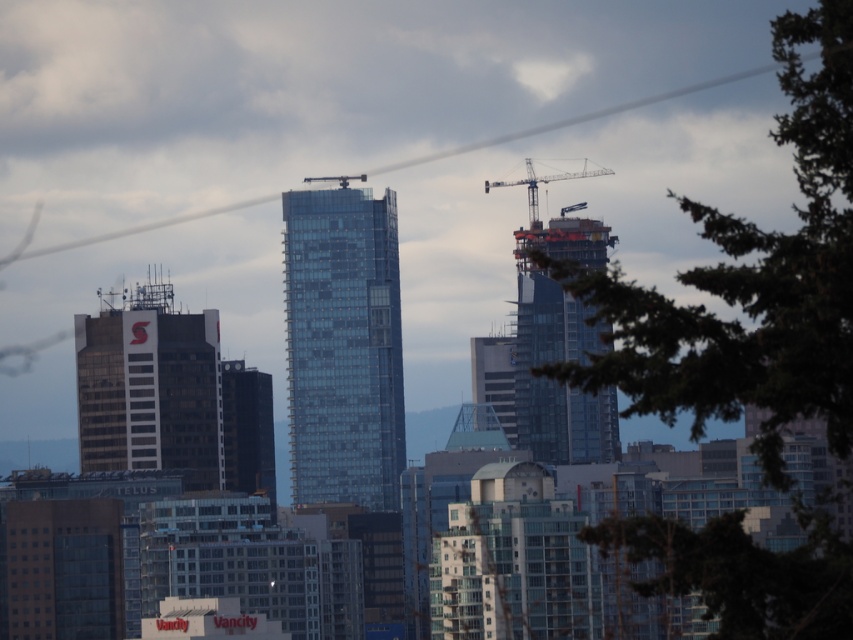
Question: Is green leafy tree at upper right above transparent glass building at center?

Choices:
 (A) yes
 (B) no

Answer: (A)

Question: Does green leafy tree at upper right come behind metallic gray crane at upper right?

Choices:
 (A) yes
 (B) no

Answer: (A)

Question: Considering the real-world distances, which object is closest to the transparent glass building at center?

Choices:
 (A) glassy steel skyscraper at center
 (B) green leafy tree at center
 (C) metallic gray crane at upper right

Answer: (A)

Question: Which object appears farthest from the camera in this image?

Choices:
 (A) green leafy tree at center
 (B) transparent glass building at center
 (C) glassy steel skyscraper at center

Answer: (A)

Question: In this image, where is green leafy tree at upper right located relative to glassy steel skyscraper at center?

Choices:
 (A) below
 (B) above

Answer: (B)

Question: Which object is the farthest from the transparent glass building at center?

Choices:
 (A) green leafy tree at upper right
 (B) green leafy tree at center
 (C) metallic gray crane at upper right
 (D) glassy steel skyscraper at center

Answer: (B)